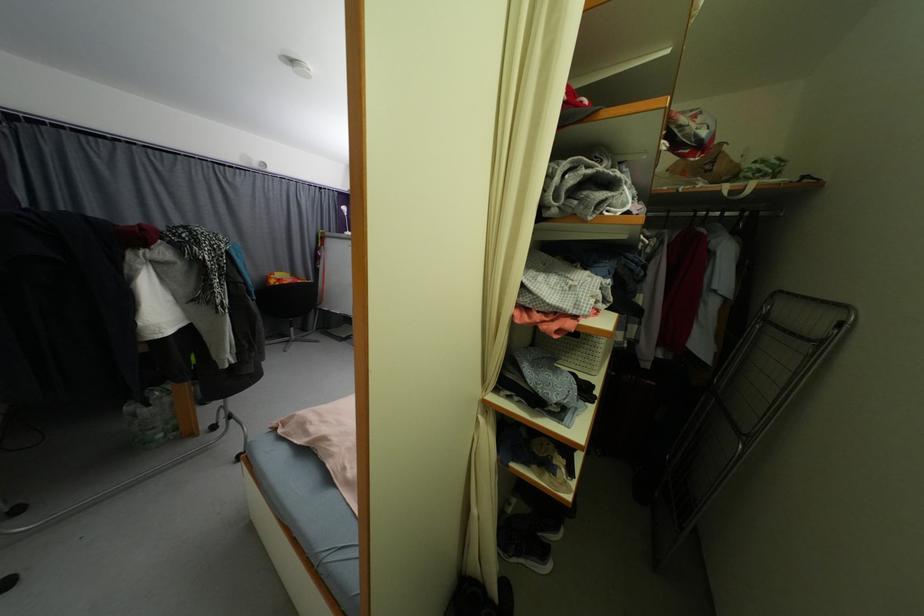
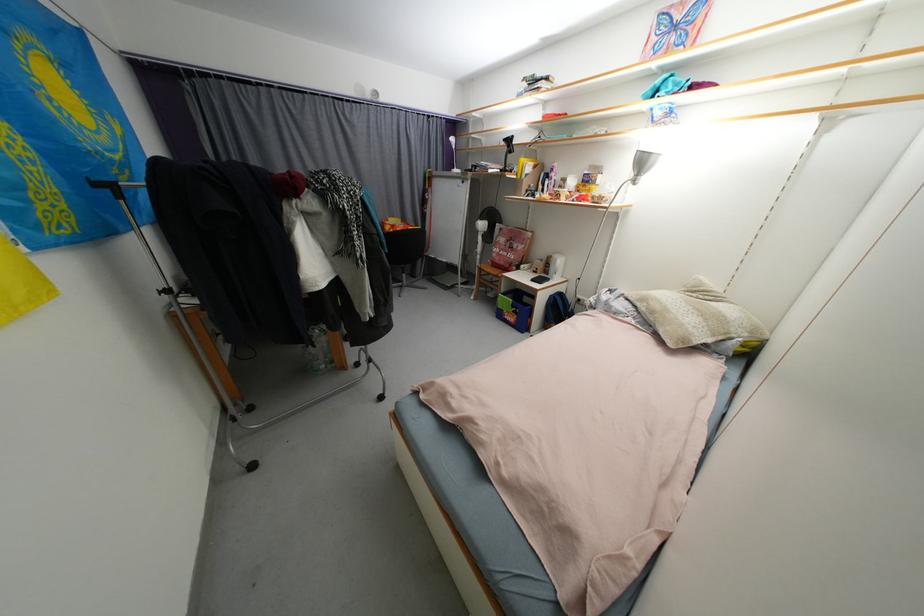
Which direction would the cameraman need to move to produce the second image?

The cameraman walked toward left, forward.